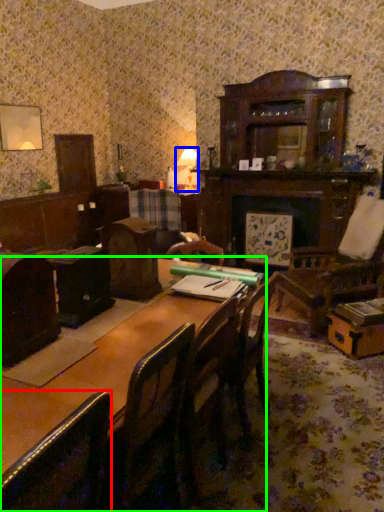
Question: Based on their relative distances, which object is farther from chair (highlighted by a red box)? Choose from table lamp (highlighted by a blue box) and table (highlighted by a green box).

Choices:
 (A) table lamp
 (B) table

Answer: (A)